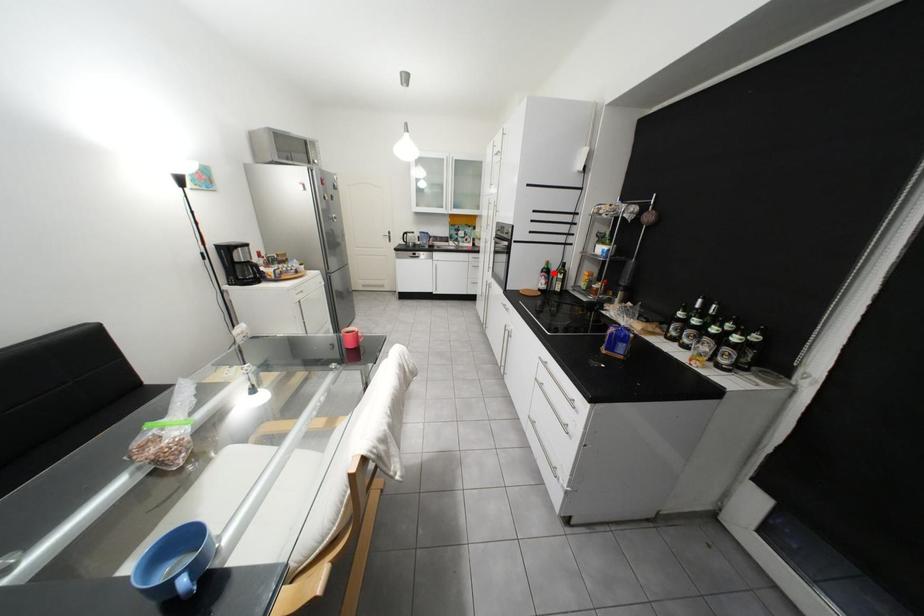
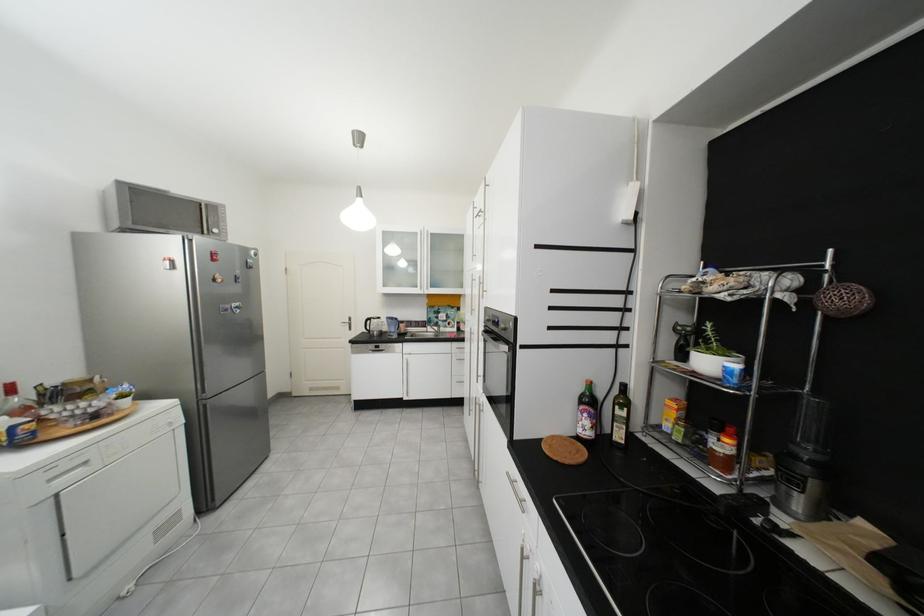
Question: I am providing you with two images of the same scene from different viewpoints. In image1, a red point is highlighted. Considering the same 3D point in image2, which of the following is correct?

Choices:
 (A) It is closer
 (B) It is farther

Answer: (B)